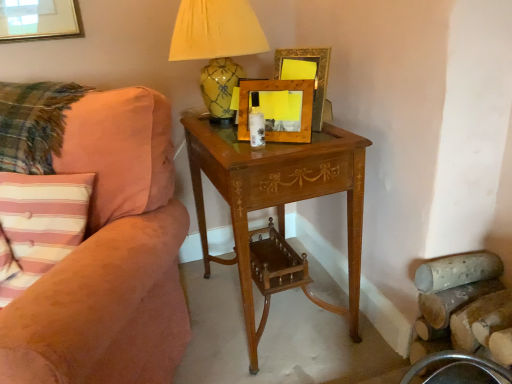
Question: Considering the relative positions of wooden picture frame at center, arranged as the 1th picture frame when viewed from the front, and suede-like peach couch at left in the image provided, is wooden picture frame at center, arranged as the 1th picture frame when viewed from the front, to the left of suede-like peach couch at left from the viewer's perspective?

Choices:
 (A) no
 (B) yes

Answer: (A)

Question: From a real-world perspective, is wooden picture frame at center, arranged as the 1th picture frame when viewed from the front, located higher than suede-like peach couch at left?

Choices:
 (A) yes
 (B) no

Answer: (A)

Question: Does wooden picture frame at center, arranged as the 1th picture frame when viewed from the front, have a lesser height compared to suede-like peach couch at left?

Choices:
 (A) no
 (B) yes

Answer: (B)

Question: Does wooden picture frame at center, which appears as the second picture frame when viewed from the back, touch suede-like peach couch at left?

Choices:
 (A) yes
 (B) no

Answer: (B)

Question: From the image's perspective, is wooden picture frame at center, arranged as the 1th picture frame when viewed from the front, on suede-like peach couch at left?

Choices:
 (A) yes
 (B) no

Answer: (A)

Question: Considering the relative sizes of wooden picture frame at center, which appears as the second picture frame when viewed from the back, and suede-like peach couch at left in the image provided, is wooden picture frame at center, which appears as the second picture frame when viewed from the back, bigger than suede-like peach couch at left?

Choices:
 (A) yes
 (B) no

Answer: (B)

Question: Is light brown wood nightstand at center facing towards wooden picture frame at upper center, placed as the 2th picture frame when sorted from front to back?

Choices:
 (A) yes
 (B) no

Answer: (B)

Question: Does light brown wood nightstand at center have a larger size compared to wooden picture frame at upper center, placed as the 2th picture frame when sorted from front to back?

Choices:
 (A) no
 (B) yes

Answer: (B)

Question: Does light brown wood nightstand at center have a greater width compared to wooden picture frame at upper center, placed as the 2th picture frame when sorted from front to back?

Choices:
 (A) yes
 (B) no

Answer: (A)

Question: Considering the relative sizes of light brown wood nightstand at center and wooden picture frame at upper center, placed as the 2th picture frame when sorted from front to back, in the image provided, is light brown wood nightstand at center taller than wooden picture frame at upper center, placed as the 2th picture frame when sorted from front to back,?

Choices:
 (A) no
 (B) yes

Answer: (B)

Question: From a real-world perspective, is light brown wood nightstand at center located beneath wooden picture frame at upper center, the 1th picture frame in the back-to-front sequence?

Choices:
 (A) no
 (B) yes

Answer: (B)

Question: Can you confirm if light brown wood nightstand at center is smaller than wooden picture frame at upper center, the 1th picture frame in the back-to-front sequence?

Choices:
 (A) no
 (B) yes

Answer: (A)

Question: Could wooden picture frame at center, arranged as the 1th picture frame when viewed from the front, be considered to be inside yellow glazed ceramic lamp at upper center?

Choices:
 (A) yes
 (B) no

Answer: (B)